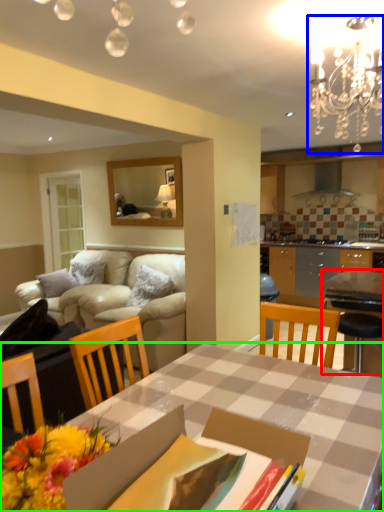
Question: Which object is the farthest from table (highlighted by a red box)? Choose among these: light fixture (highlighted by a blue box) or desk (highlighted by a green box).

Choices:
 (A) light fixture
 (B) desk

Answer: (A)